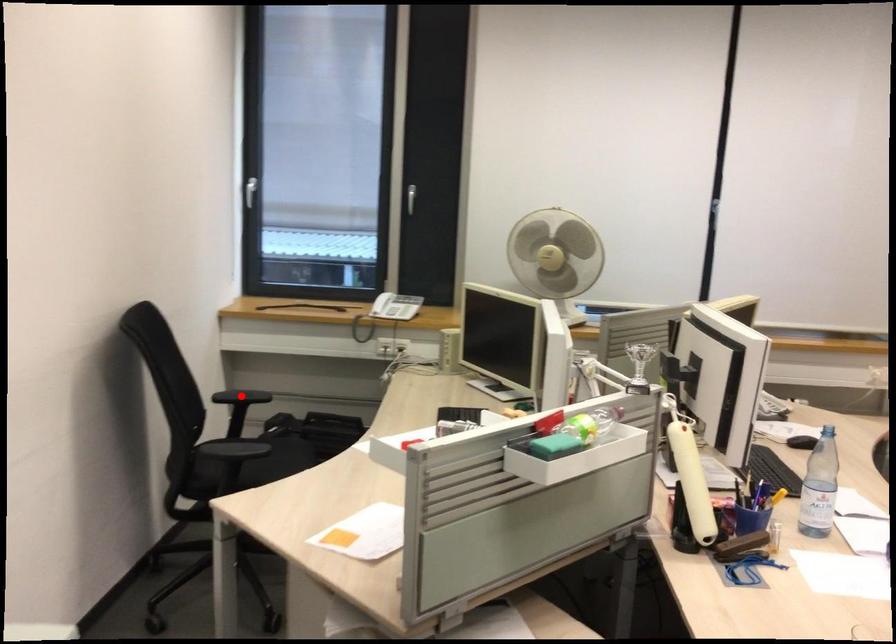
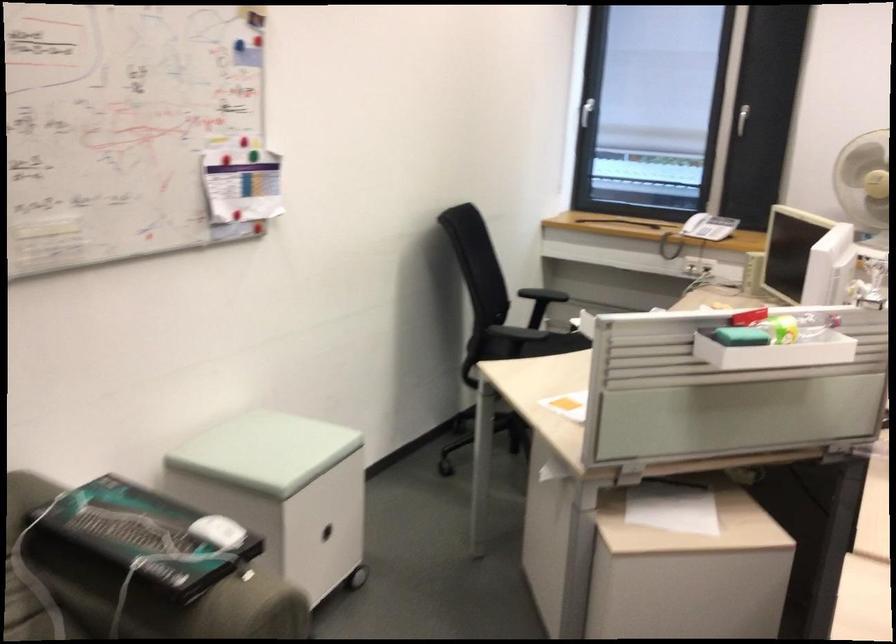
Question: I am providing you with two images of the same scene from different viewpoints. A red point is marked on the first image. Is the red point's position out of view in image 2?

Choices:
 (A) Yes
 (B) No

Answer: (A)